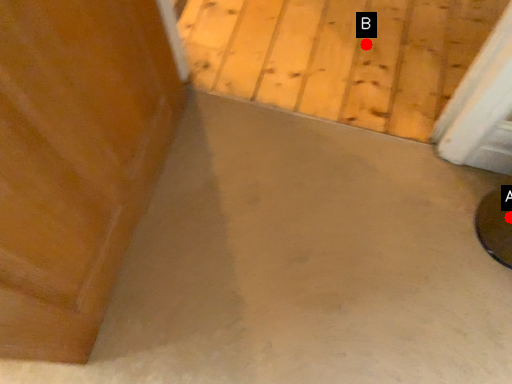
Question: Two points are circled on the image, labeled by A and B beside each circle. Which point is further to the camera?

Choices:
 (A) A is further
 (B) B is further

Answer: (B)